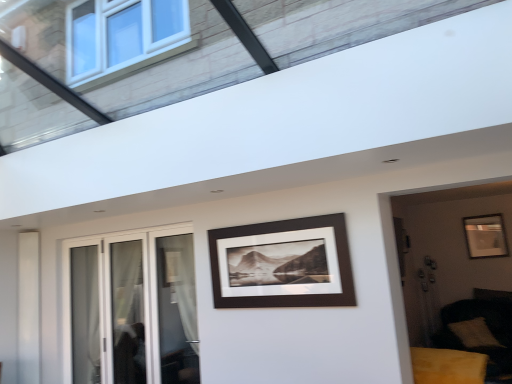
Question: Is white glass door at left bigger than matte black picture frame at center, the 1th picture frame from the left?

Choices:
 (A) no
 (B) yes

Answer: (B)

Question: Considering the relative positions of white glass door at left and matte black picture frame at center, which ranks as the first picture frame in front-to-back order, in the image provided, is white glass door at left in front of matte black picture frame at center, which ranks as the first picture frame in front-to-back order,?

Choices:
 (A) yes
 (B) no

Answer: (B)

Question: Is white glass door at left surrounding matte black picture frame at center, the 1th picture frame from the left?

Choices:
 (A) no
 (B) yes

Answer: (A)

Question: Could you tell me if white glass door at left is facing matte black picture frame at center, acting as the 2th picture frame starting from the back?

Choices:
 (A) no
 (B) yes

Answer: (A)

Question: From a real-world perspective, is white glass door at left beneath matte black picture frame at center, which is counted as the 2th picture frame, starting from the right?

Choices:
 (A) no
 (B) yes

Answer: (B)

Question: Considering the relative sizes of white glass door at left and matte black picture frame at center, the 1th picture frame from the left, in the image provided, is white glass door at left smaller than matte black picture frame at center, the 1th picture frame from the left,?

Choices:
 (A) yes
 (B) no

Answer: (B)

Question: Is soft beige cushion at lower right positioned beyond the bounds of matte black picture frame at center, which ranks as the first picture frame in front-to-back order?

Choices:
 (A) yes
 (B) no

Answer: (A)

Question: Can you confirm if soft beige cushion at lower right is thinner than matte black picture frame at center, which ranks as the first picture frame in front-to-back order?

Choices:
 (A) no
 (B) yes

Answer: (A)

Question: From the image's perspective, is soft beige cushion at lower right located beneath matte black picture frame at center, acting as the 2th picture frame starting from the back?

Choices:
 (A) no
 (B) yes

Answer: (B)

Question: Does soft beige cushion at lower right appear on the left side of matte black picture frame at center, which is counted as the 2th picture frame, starting from the right?

Choices:
 (A) no
 (B) yes

Answer: (A)

Question: From a real-world perspective, is soft beige cushion at lower right beneath matte black picture frame at center, which ranks as the first picture frame in front-to-back order?

Choices:
 (A) yes
 (B) no

Answer: (A)

Question: Does soft beige cushion at lower right have a greater width compared to matte black picture frame at center, which is counted as the 2th picture frame, starting from the right?

Choices:
 (A) no
 (B) yes

Answer: (B)

Question: Is matte black picture frame at center, the 1th picture frame from the left, touching yellow velvet sofa at lower right?

Choices:
 (A) no
 (B) yes

Answer: (A)